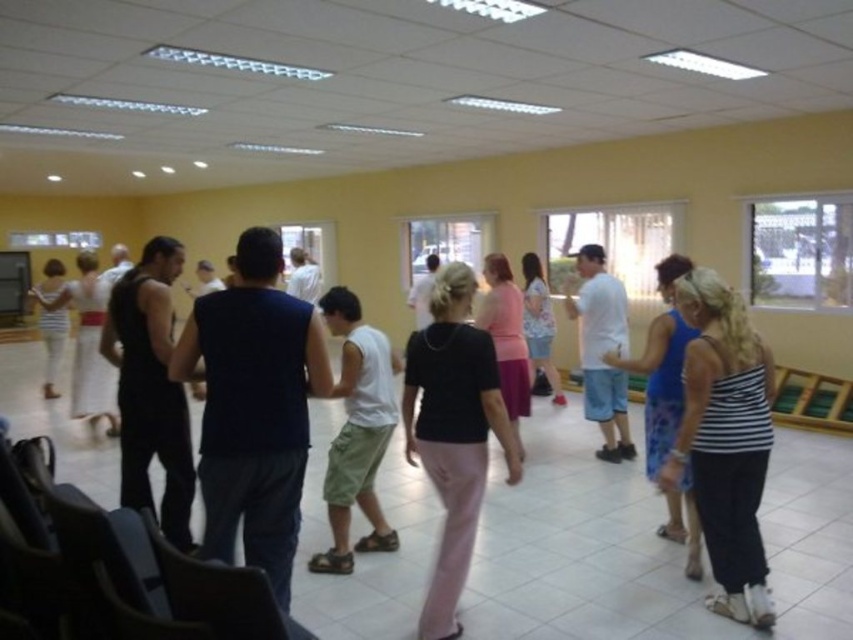
Is dark blue sleeveless shirt at center shorter than white cotton shirt at center?

Yes, dark blue sleeveless shirt at center is shorter than white cotton shirt at center.

Is point (230, 502) closer to viewer compared to point (585, 328)?

Yes, point (230, 502) is closer to viewer.

The height and width of the screenshot is (640, 853). In order to click on dark blue sleeveless shirt at center in this screenshot , I will do `click(254, 408)`.

Can you confirm if dark blue sleeveless shirt at center is positioned below striped fabric top at lower right?

Incorrect, dark blue sleeveless shirt at center is not positioned below striped fabric top at lower right.

Which is in front, point (316, 337) or point (726, 589)?

Point (316, 337) is in front.

Is point (254, 403) less distant than point (666, 456)?

Yes, point (254, 403) is in front of point (666, 456).

The image size is (853, 640). I want to click on dark blue sleeveless shirt at center, so click(x=254, y=408).

Is point (585, 336) farther from viewer compared to point (45, 396)?

That is False.

Is white cotton shirt at center bigger than white cotton dress at left?

No, white cotton shirt at center is not bigger than white cotton dress at left.

Image resolution: width=853 pixels, height=640 pixels. I want to click on white cotton shirt at center, so click(x=602, y=349).